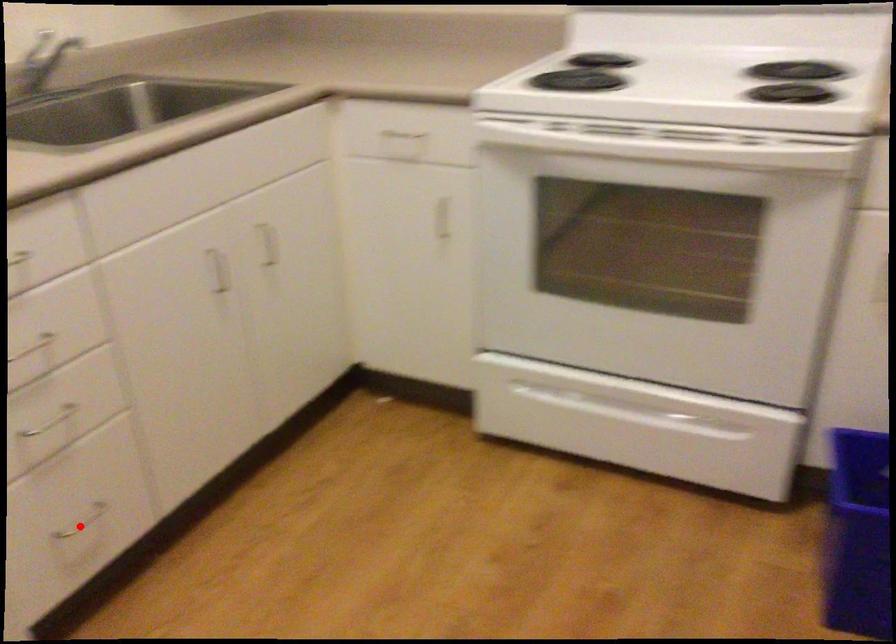
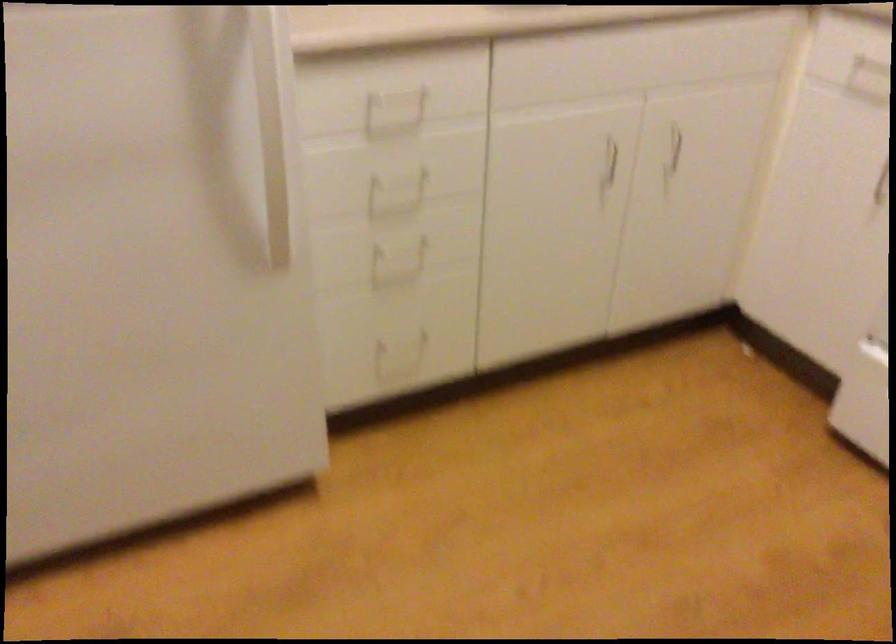
Question: I am providing you with two images of the same scene from different viewpoints. Given a red point in image1, look at the same physical point in image2. Is it:

Choices:
 (A) Closer to the viewpoint
 (B) Farther from the viewpoint

Answer: (B)